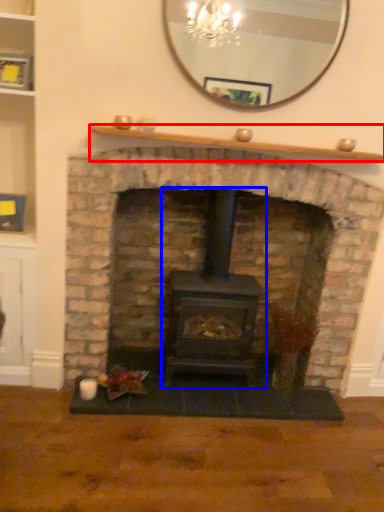
Question: Which of the following is the closest to the observer, mantle (highlighted by a red box) or wood burning stove (highlighted by a blue box)?

Choices:
 (A) mantle
 (B) wood burning stove

Answer: (A)